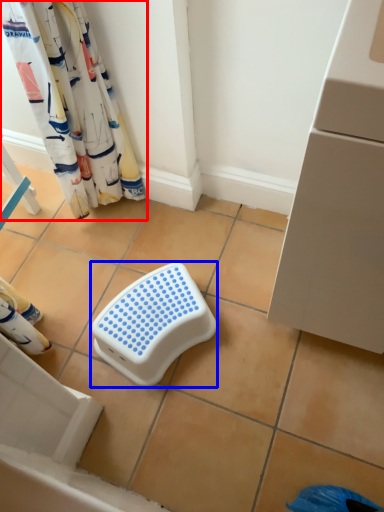
Question: Which object is further to the camera taking this photo, curtain (highlighted by a red box) or step stool (highlighted by a blue box)?

Choices:
 (A) curtain
 (B) step stool

Answer: (B)